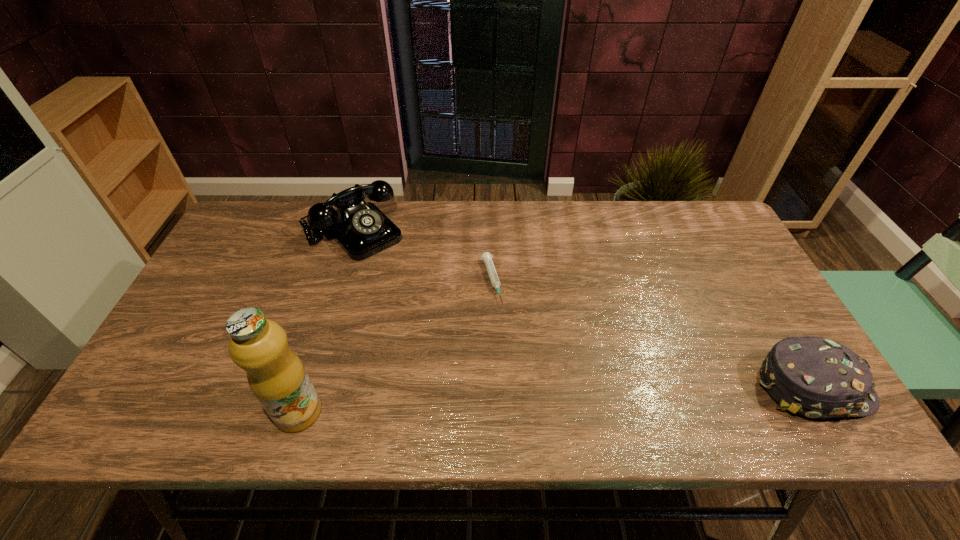
This screenshot has width=960, height=540. Identify the location of free space on the desktop that is between the fruit juice and the rightmost object and is positioned at the needle end of the shortest object. [531, 400].

At what (x,y) coordinates should I click in order to perform the action: click on free space on the desktop that is between the tallest object and the headwear and is positioned on the dial of the second tallest object. Please return your answer as a coordinate pair (x, y). Looking at the image, I should click on [x=510, y=401].